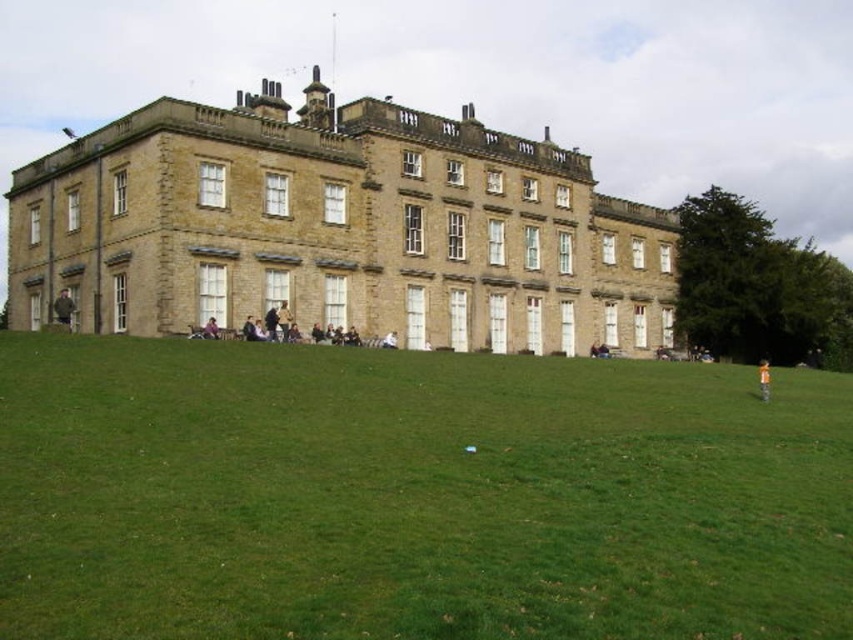
Question: Is dark brown leather jacket at lower left to the left of orange fabric person at lower right from the viewer's perspective?

Choices:
 (A) no
 (B) yes

Answer: (B)

Question: Which object is closer to the camera taking this photo?

Choices:
 (A) green grass at lower center
 (B) orange fabric person at lower right
 (C) dark purple shirt at center

Answer: (A)

Question: Estimate the real-world distances between objects in this image. Which object is closer to the green grass at lower center?

Choices:
 (A) dark brown leather jacket at lower left
 (B) orange fabric person at lower right

Answer: (A)

Question: Does green grass at lower center appear over dark brown leather jacket at lower left?

Choices:
 (A) no
 (B) yes

Answer: (A)

Question: Does green grass at lower center appear on the left side of orange fabric person at lower right?

Choices:
 (A) yes
 (B) no

Answer: (A)

Question: Which point is closer to the camera taking this photo?

Choices:
 (A) (434, 362)
 (B) (763, 371)

Answer: (B)